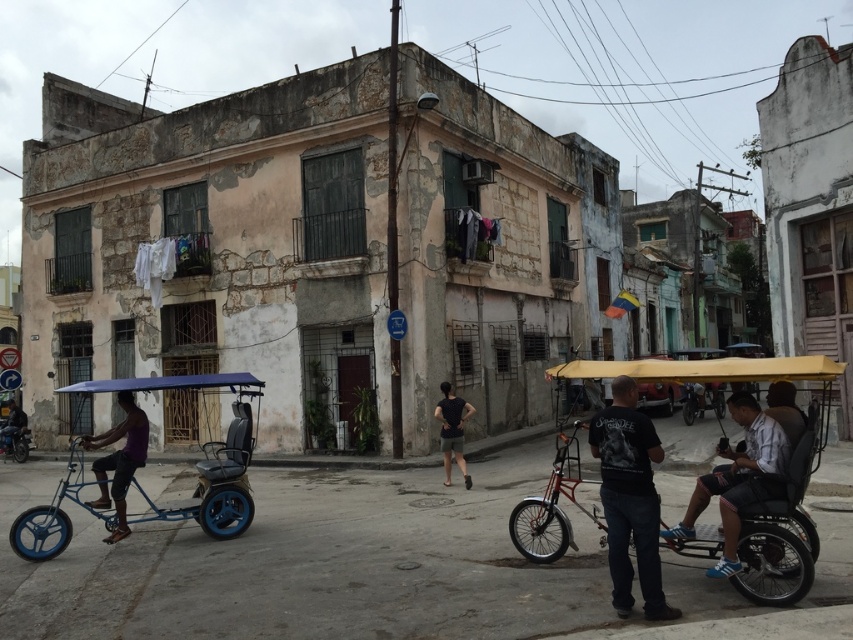
Describe the element at coordinates (553, 506) in the screenshot. Image resolution: width=853 pixels, height=640 pixels. I see `shiny metallic bicycle at center` at that location.

Is point (541, 531) farther from camera compared to point (440, 422)?

That is False.

Describe the element at coordinates (553, 506) in the screenshot. I see `shiny metallic bicycle at center` at that location.

The height and width of the screenshot is (640, 853). I want to click on shiny metallic bicycle at center, so click(553, 506).

Is yellow fabric-covered tricycle at center to the right of purple fabric pedicab at left from the viewer's perspective?

Indeed, yellow fabric-covered tricycle at center is positioned on the right side of purple fabric pedicab at left.

Is yellow fabric-covered tricycle at center shorter than purple fabric pedicab at left?

No.

In order to click on yellow fabric-covered tricycle at center in this screenshot , I will do coord(781,532).

The image size is (853, 640). Identify the location of yellow fabric-covered tricycle at center. coord(781,532).

Does point (560, 435) come closer to viewer compared to point (122, 465)?

No, it is not.

Which of these two, shiny metallic bicycle at center or purple fabric pedicab at left, stands taller?

shiny metallic bicycle at center is taller.

Which is behind, point (593, 522) or point (143, 412)?

The point (143, 412) is more distant.

Identify the location of shiny metallic bicycle at center. (x=553, y=506).